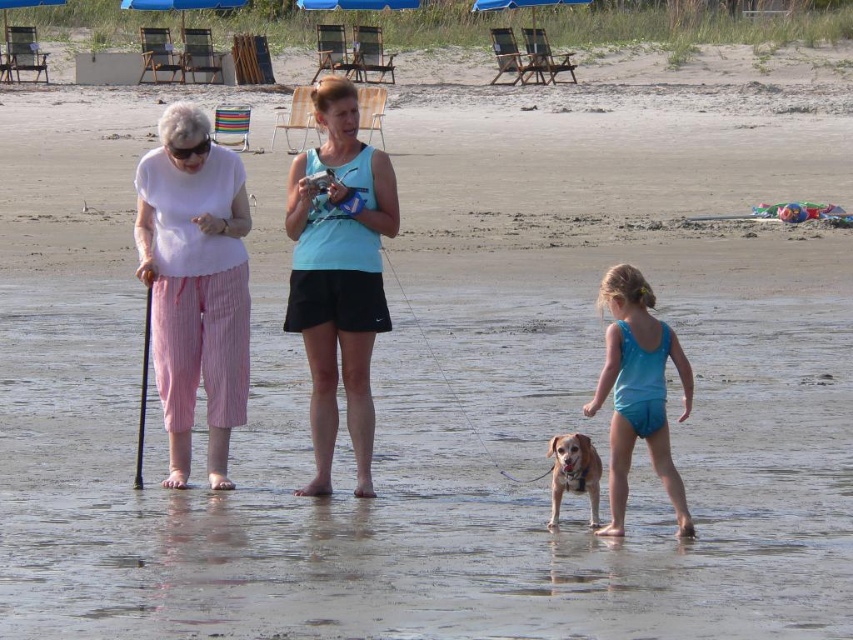
Looking at this image, does brown fur dog at center come behind blue fabric umbrella at upper center?

That is False.

Which is above, brown fur dog at center or blue fabric umbrella at upper center?

blue fabric umbrella at upper center is higher up.

Which is in front, point (553, 518) or point (527, 0)?

Point (553, 518) is more forward.

Identify the location of brown fur dog at center. The image size is (853, 640). (573, 472).

Is pink striped pants at left closer to camera compared to brown fur dog at center?

That is False.

In the scene shown: Which is below, pink striped pants at left or brown fur dog at center?

brown fur dog at center is lower down.

Is point (190, 403) positioned after point (589, 484)?

Yes.

In order to click on pink striped pants at left in this screenshot , I will do `click(195, 284)`.

Is pink striped pants at left above blue fabric swimsuit at lower right?

Correct, pink striped pants at left is located above blue fabric swimsuit at lower right.

How distant is pink striped pants at left from blue fabric swimsuit at lower right?

pink striped pants at left is 2.32 meters from blue fabric swimsuit at lower right.

Which is in front, point (181, 369) or point (611, 342)?

Point (611, 342) is in front.

Locate an element on the screen. pink striped pants at left is located at coordinates (195, 284).